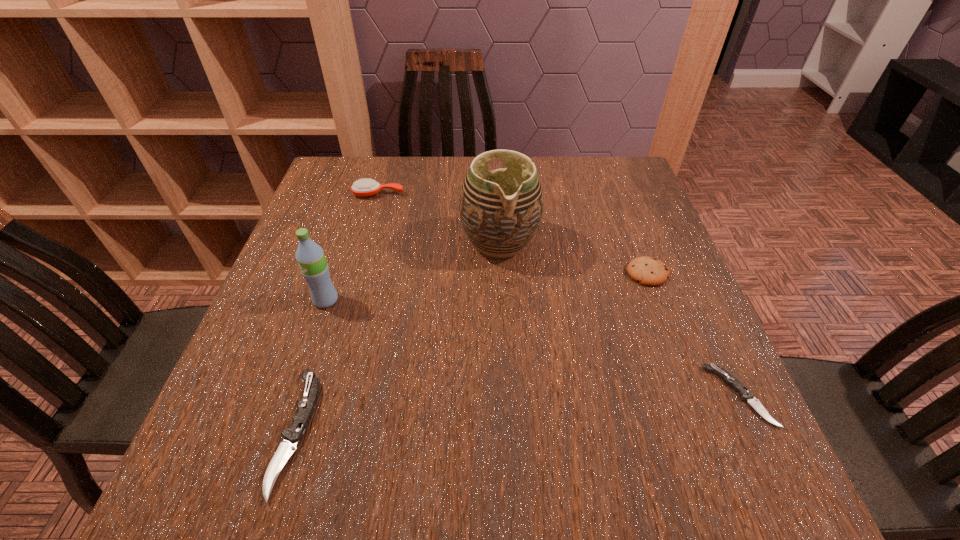
The width and height of the screenshot is (960, 540). Find the location of `the second shortest object`. the second shortest object is located at coordinates (293, 435).

What are the coordinates of `the taller pocketknife` in the screenshot? It's located at (293, 435).

Locate an element on the screen. the right pocketknife is located at coordinates (746, 395).

In order to click on the shortest object in this screenshot , I will do `click(746, 395)`.

Locate an element on the screen. The width and height of the screenshot is (960, 540). the third object from right to left is located at coordinates (500, 210).

Identify the location of the farthest object. (364, 187).

At what (x,y) coordinates should I click in order to perform the action: click on hairbrush. Please return your answer as a coordinate pair (x, y). The image size is (960, 540). Looking at the image, I should click on (364, 187).

You are a GUI agent. You are given a task and a screenshot of the screen. Output one action in this format:
    pyautogui.click(x=<x>, y=<y>)
    Task: Click on the third nearest object
    This screenshot has width=960, height=540.
    Given the screenshot: What is the action you would take?
    pyautogui.click(x=310, y=256)

Find the location of a particular element. The height and width of the screenshot is (540, 960). cookie is located at coordinates (648, 271).

Where is `vacant space located on the right of the taller pocketknife`? The image size is (960, 540). vacant space located on the right of the taller pocketknife is located at coordinates [x=468, y=432].